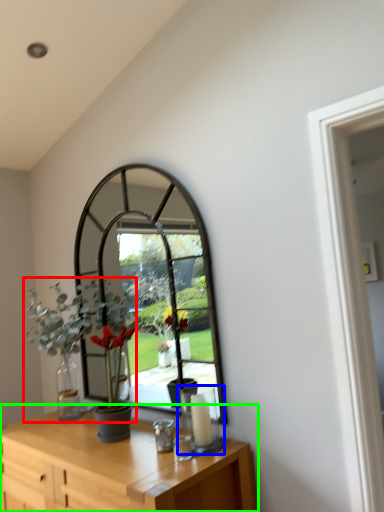
Question: Which is nearer to the houseplant (highlighted by a red box)? candle holder (highlighted by a blue box) or table (highlighted by a green box).

Choices:
 (A) candle holder
 (B) table

Answer: (B)